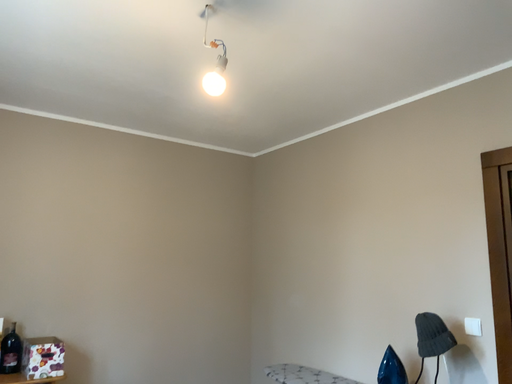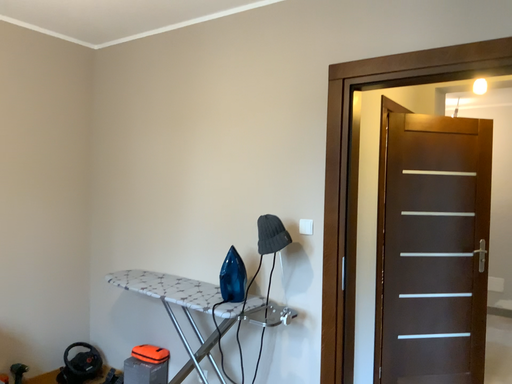
Question: How did the camera likely rotate when shooting the video?

Choices:
 (A) rotated left
 (B) rotated right

Answer: (B)